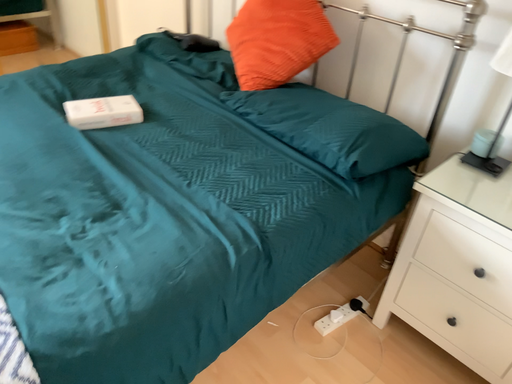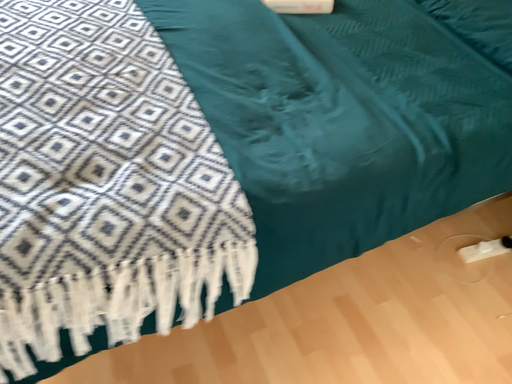
Question: Which way did the camera rotate in the video?

Choices:
 (A) rotated left
 (B) rotated right

Answer: (A)